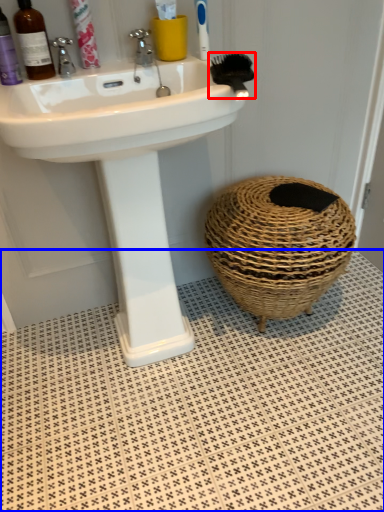
Question: Which point is further to the camera, brush (highlighted by a red box) or tile (highlighted by a blue box)?

Choices:
 (A) brush
 (B) tile

Answer: (A)